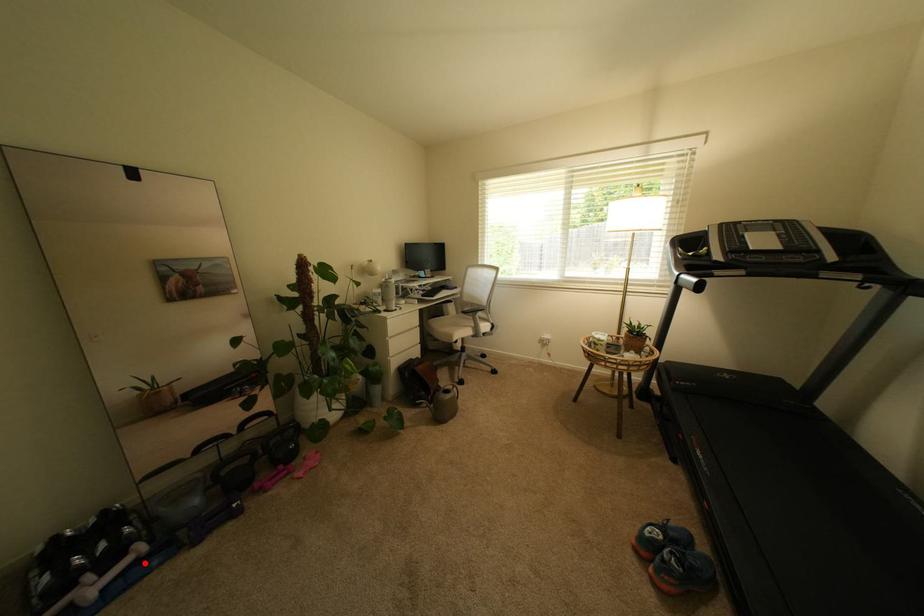
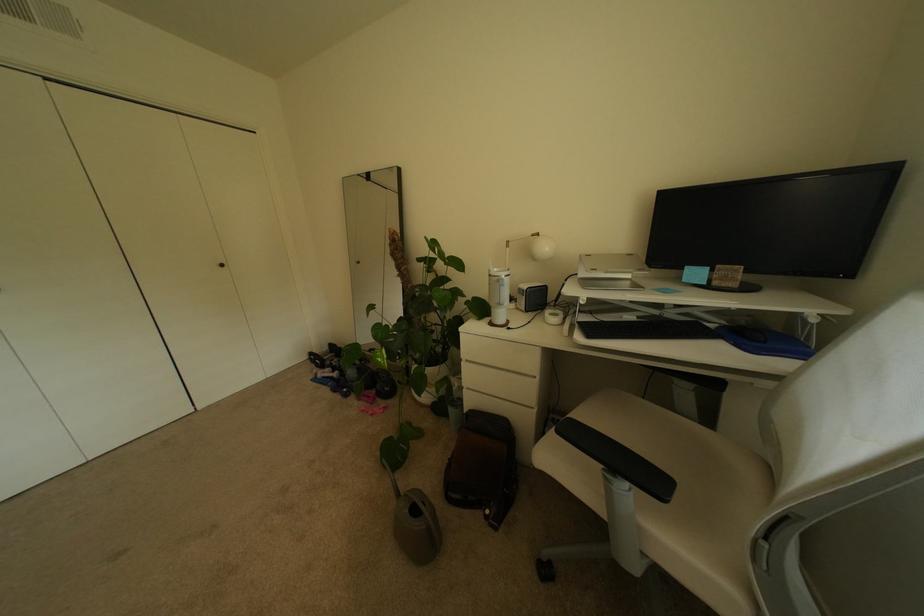
Question: I am providing you with two images of the same scene from different viewpoints. Given a red point in image1, look at the same physical point in image2. Is it:

Choices:
 (A) Closer to the viewpoint
 (B) Farther from the viewpoint

Answer: (B)